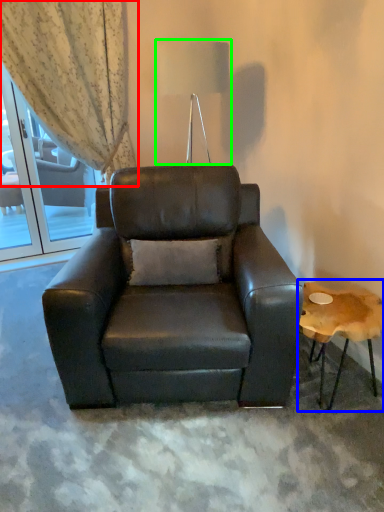
Question: Based on their relative distances, which object is nearer to curtain (highlighted by a red box)? Choose from table (highlighted by a blue box) and table lamp (highlighted by a green box).

Choices:
 (A) table
 (B) table lamp

Answer: (B)